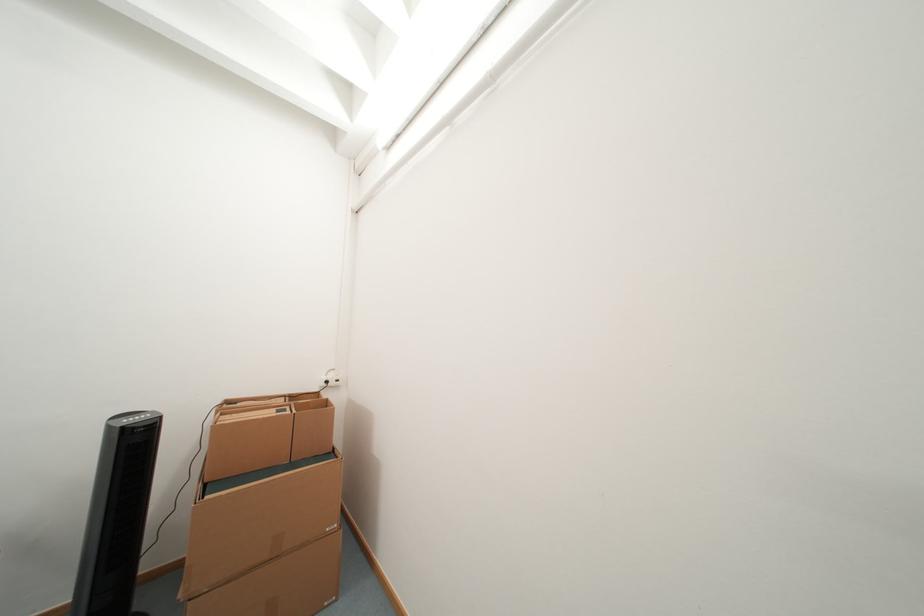
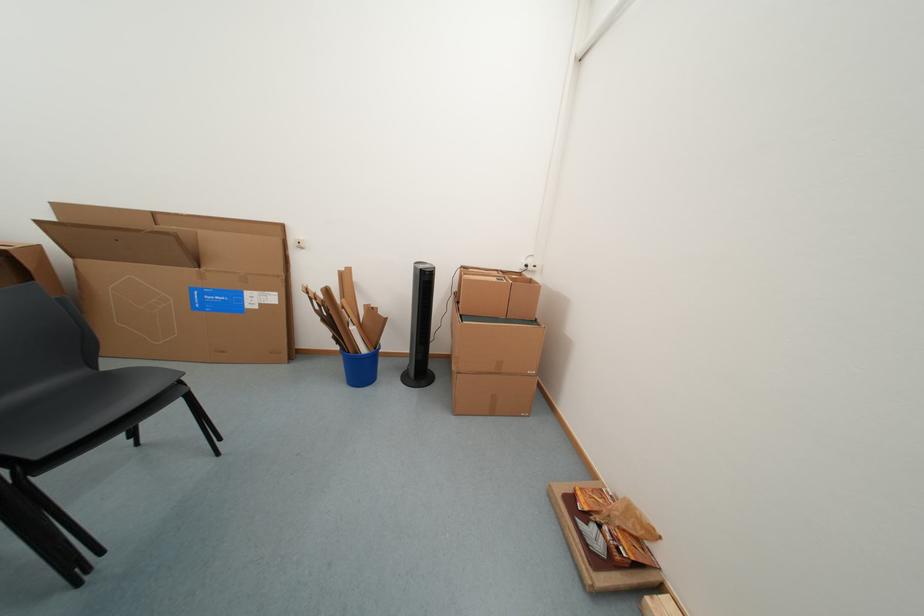
First-person continuous shooting, in which direction is the camera rotating?

The camera rotated toward left-down.